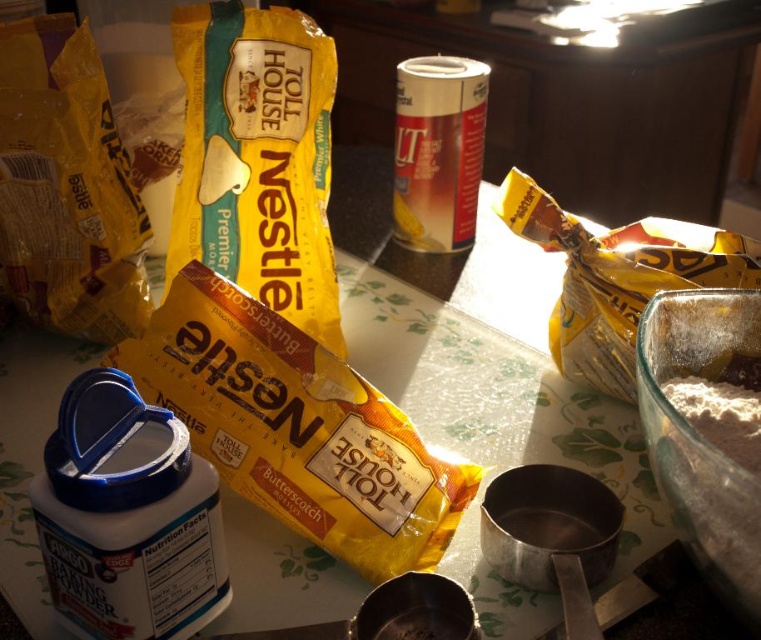
Which is in front, point (158, 358) or point (651, 246)?

Point (158, 358) is more forward.

The image size is (761, 640). Identify the location of yellow matte plastic bag of nestle toll house butterscotch at center. (295, 428).

Which is above, yellow matte plastic bag of nestle toll house premier butter at center or butterscotch candy at upper right?

yellow matte plastic bag of nestle toll house premier butter at center is above.

Can you confirm if yellow matte plastic bag of nestle toll house premier butter at center is bigger than butterscotch candy at upper right?

Incorrect, yellow matte plastic bag of nestle toll house premier butter at center is not larger than butterscotch candy at upper right.

Is point (311, 106) positioned in front of point (543, 236)?

No, it is behind (543, 236).

This screenshot has width=761, height=640. I want to click on yellow matte plastic bag of nestle toll house premier butter at center, so click(x=256, y=157).

Looking at this image, between yellow matte plastic bag of nestle toll house butterscotch at center and metallic silver can at center, which one has more height?

With more height is metallic silver can at center.

From the picture: Does yellow matte plastic bag of nestle toll house butterscotch at center appear on the right side of metallic silver can at center?

No, yellow matte plastic bag of nestle toll house butterscotch at center is not to the right of metallic silver can at center.

Is point (240, 432) positioned behind point (395, 173)?

No, (240, 432) is closer to viewer.

Where is `yellow matte plastic bag of nestle toll house butterscotch at center`? yellow matte plastic bag of nestle toll house butterscotch at center is located at coordinates (295, 428).